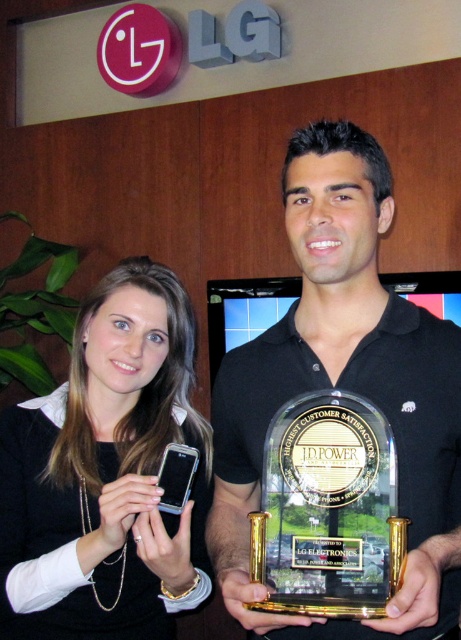
Question: Does matte black phone at center have a lesser width compared to clear acrylic trophy at center?

Choices:
 (A) no
 (B) yes

Answer: (A)

Question: Which point is farther from the camera taking this photo?

Choices:
 (A) (306, 406)
 (B) (53, 420)

Answer: (B)

Question: Which object is closer to the camera taking this photo?

Choices:
 (A) black glossy trophy at center
 (B) matte black phone at center
 (C) clear acrylic trophy at center

Answer: (A)

Question: Can you confirm if black glossy trophy at center is positioned below clear acrylic trophy at center?

Choices:
 (A) yes
 (B) no

Answer: (B)

Question: Which point appears closest to the camera in this image?

Choices:
 (A) tap(373, 333)
 (B) tap(141, 566)
 (C) tap(370, 540)

Answer: (C)

Question: Can you confirm if black glossy trophy at center is wider than clear acrylic trophy at center?

Choices:
 (A) yes
 (B) no

Answer: (A)